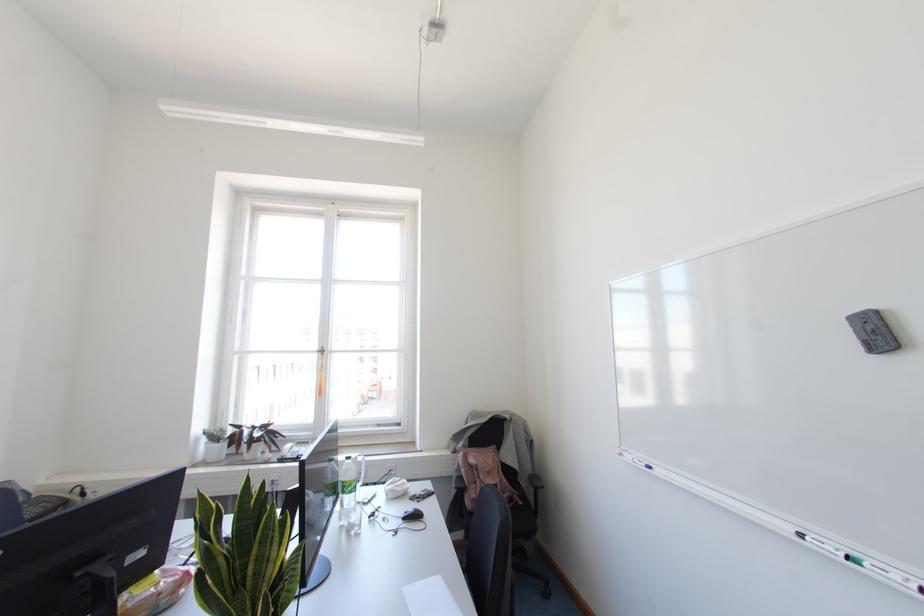
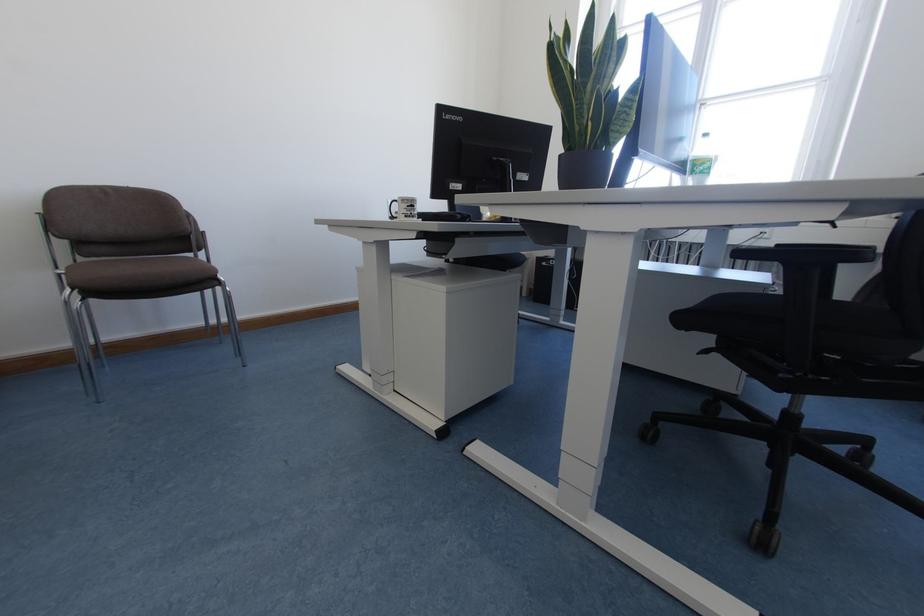
The point at (256, 559) is marked in the first image. Where is the corresponding point in the second image?

(593, 77)